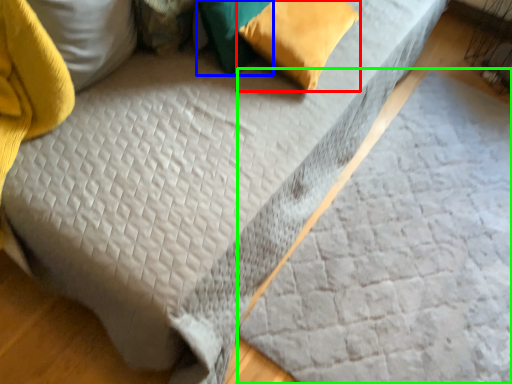
Question: Considering the real-world distances, which object is closest to pillow (highlighted by a red box)? pillow (highlighted by a blue box) or sheet (highlighted by a green box).

Choices:
 (A) pillow
 (B) sheet

Answer: (A)